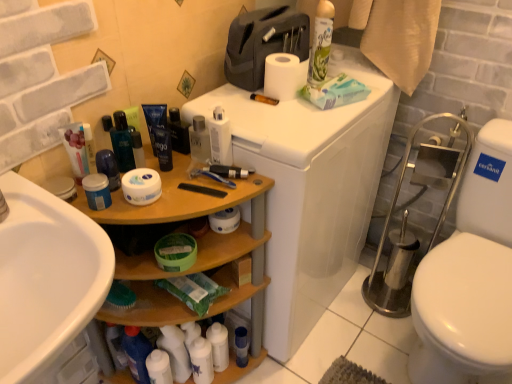
This screenshot has height=384, width=512. I want to click on vacant space in front of blue matte shaving cream at center, the 6th toiletry from the right, so click(x=166, y=200).